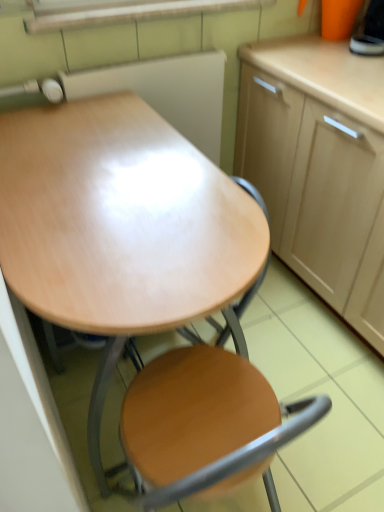
Question: Is point (243, 466) closer or farther from the camera than point (36, 307)?

Choices:
 (A) farther
 (B) closer

Answer: (B)

Question: In terms of width, does wooden at center look wider or thinner when compared to wooden desk at center?

Choices:
 (A) wide
 (B) thin

Answer: (B)

Question: Which object is the farthest from the wooden desk at center?

Choices:
 (A) wooden at center
 (B) light wood cabinet at upper right

Answer: (B)

Question: Which is nearer to the wooden desk at center?

Choices:
 (A) light wood cabinet at upper right
 (B) wooden at center

Answer: (B)